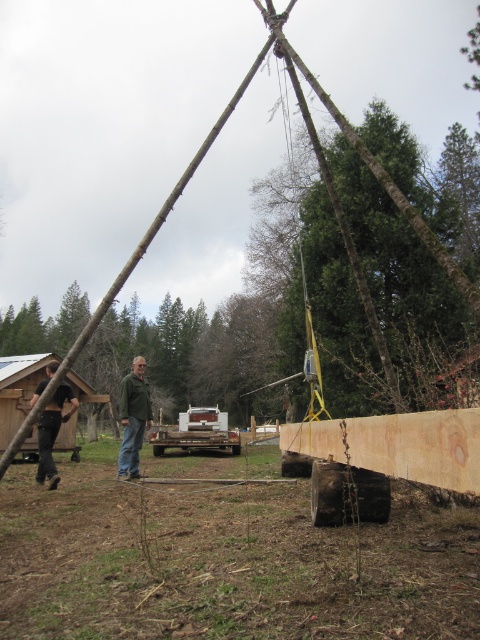
Is brown wood tree at center bigger than black leather pants at lower left?

Yes.

In order to click on brown wood tree at center in this screenshot , I will do `click(192, 355)`.

Is point (242, 385) positioned in front of point (127, 410)?

No, it is behind (127, 410).

Can you confirm if brown wood tree at center is smaller than green matte jacket at center?

Incorrect, brown wood tree at center is not smaller in size than green matte jacket at center.

Is point (62, 339) closer to viewer compared to point (139, 451)?

That is False.

What are the coordinates of `brown wood tree at center` in the screenshot? It's located at (192, 355).

Does point (139, 422) come behind point (62, 380)?

Yes, point (139, 422) is behind point (62, 380).

Is green matte jacket at center closer to the viewer compared to black leather pants at lower left?

No, green matte jacket at center is further to the viewer.

Locate an element on the screen. green matte jacket at center is located at coordinates (132, 419).